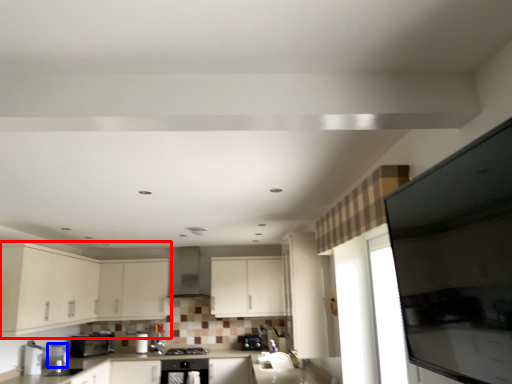
Question: Among these objects, which one is farthest to the camera, cabinetry (highlighted by a red box) or appliance (highlighted by a blue box)?

Choices:
 (A) cabinetry
 (B) appliance

Answer: (B)